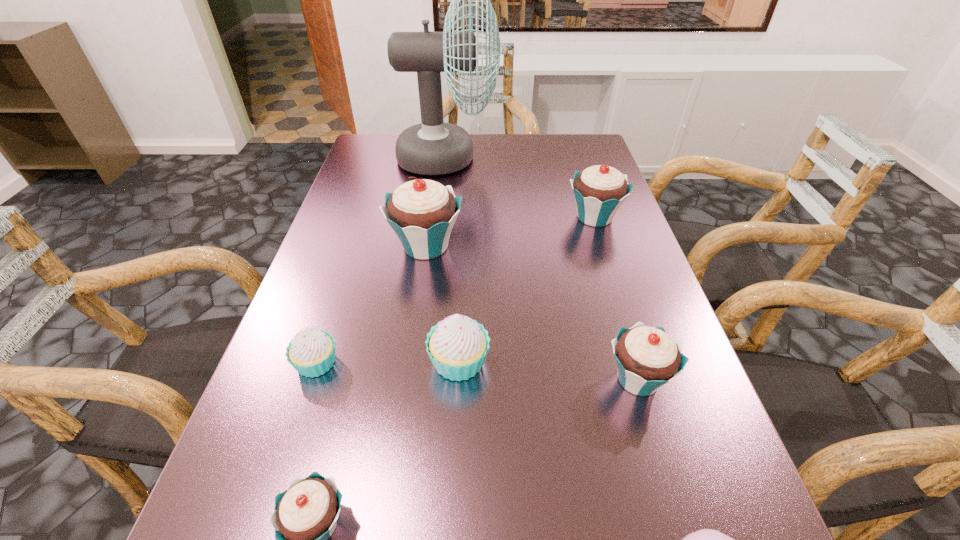
The height and width of the screenshot is (540, 960). I want to click on vacant position located 0.230m on the right of the biggest teal cupcake, so click(564, 246).

This screenshot has height=540, width=960. I want to click on free space located on the left of the third tallest object, so click(x=525, y=217).

Where is `vacant space located 0.290m on the right of the bigger white cupcake`? Image resolution: width=960 pixels, height=540 pixels. vacant space located 0.290m on the right of the bigger white cupcake is located at coordinates (653, 361).

You are a GUI agent. You are given a task and a screenshot of the screen. Output one action in this format:
    pyautogui.click(x=<x>, y=<y>)
    Task: Click on the vacant space located on the left of the second nearest teal cupcake
    The width and height of the screenshot is (960, 540).
    Given the screenshot: What is the action you would take?
    pyautogui.click(x=517, y=379)

Where is `vacant space situated 0.250m on the right of the smaller white cupcake`? vacant space situated 0.250m on the right of the smaller white cupcake is located at coordinates [481, 363].

What are the coordinates of `object present at the far edge` in the screenshot? It's located at (433, 147).

Where is `fan that is positioned at the left edge`? The width and height of the screenshot is (960, 540). fan that is positioned at the left edge is located at coordinates (433, 147).

In order to click on object that is at the far left corner in this screenshot , I will do `click(433, 147)`.

In the image, there is a desktop. Find the location of `blank space at the far edge`. blank space at the far edge is located at coordinates (494, 140).

This screenshot has height=540, width=960. I want to click on vacant area at the left edge of the desktop, so click(287, 435).